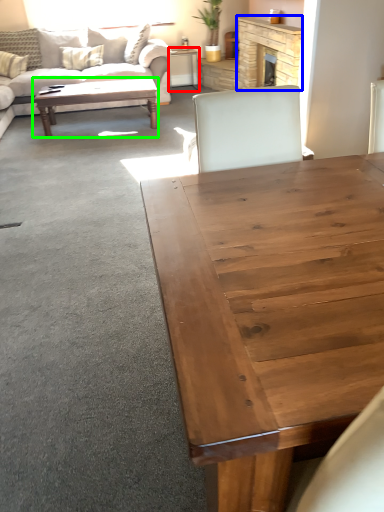
Question: Which object is the closest to the desk (highlighted by a red box)? Choose among these: fireplace (highlighted by a blue box) or coffee table (highlighted by a green box).

Choices:
 (A) fireplace
 (B) coffee table

Answer: (A)